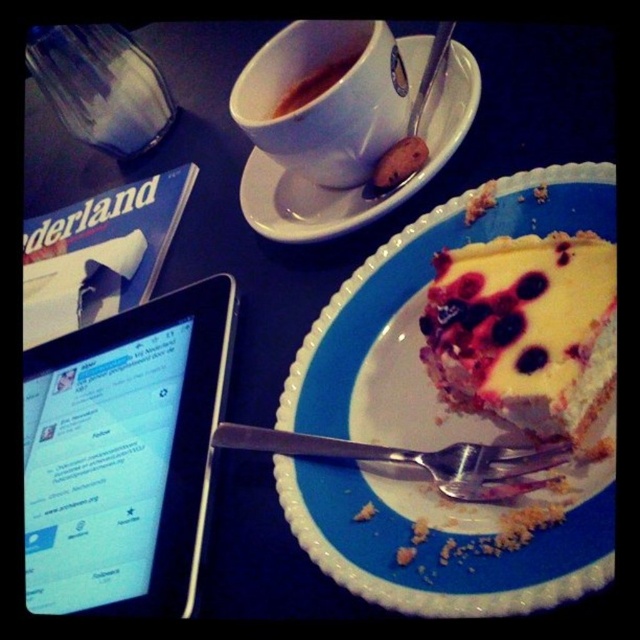
Does yellow cake at right have a smaller size compared to white ceramic saucer at upper center?

Incorrect, yellow cake at right is not smaller in size than white ceramic saucer at upper center.

Is point (570, 468) positioned in front of point (416, 49)?

Yes, it is.

This screenshot has height=640, width=640. I want to click on yellow cake at right, so click(445, 538).

Can you confirm if white ceramic saucer at upper center is positioned to the left of silver metallic fork at lower center?

Indeed, white ceramic saucer at upper center is positioned on the left side of silver metallic fork at lower center.

Is white ceramic saucer at upper center closer to camera compared to silver metallic fork at lower center?

No, it is not.

Is point (262, 209) less distant than point (476, 496)?

No, (262, 209) is further to viewer.

Find the location of a particular element. This screenshot has width=640, height=640. white ceramic saucer at upper center is located at coordinates coord(360,182).

Is silver metallic fork at lower center positioned at the back of glossy ceramic mug at upper center?

That is False.

Who is more distant from viewer, (276, 438) or (280, 109)?

The point (280, 109) is behind.

What do you see at coordinates (416, 460) in the screenshot? I see `silver metallic fork at lower center` at bounding box center [416, 460].

Find the location of a particular element. The height and width of the screenshot is (640, 640). silver metallic fork at lower center is located at coordinates (416, 460).